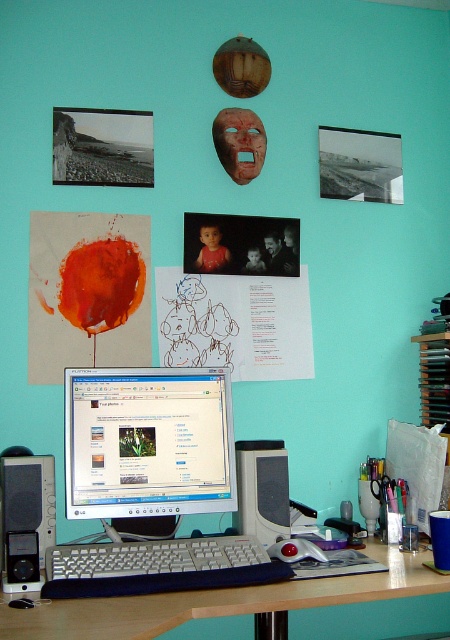
You are organizing your desk and want to place a new item between the wooden at center and the black plastic speaker at center. Which object should you place the new item closer to so that it is still in front of the other?

You should place the new item closer to the wooden at center because it is already closer to the viewer than the black plastic speaker at center, so positioning the new item near the wooden at center will keep it in front of the speaker.

You are standing in front of the workspace and want to determine the relative positions of two points marked on the desk. Which point is closer to you, point at coordinate point (130,483) or point at coordinate point (45,513)?

Point at coordinate point (130,483) is further to the camera than point at coordinate point (45,513), so the point at coordinate point (45,513) is closer to you.